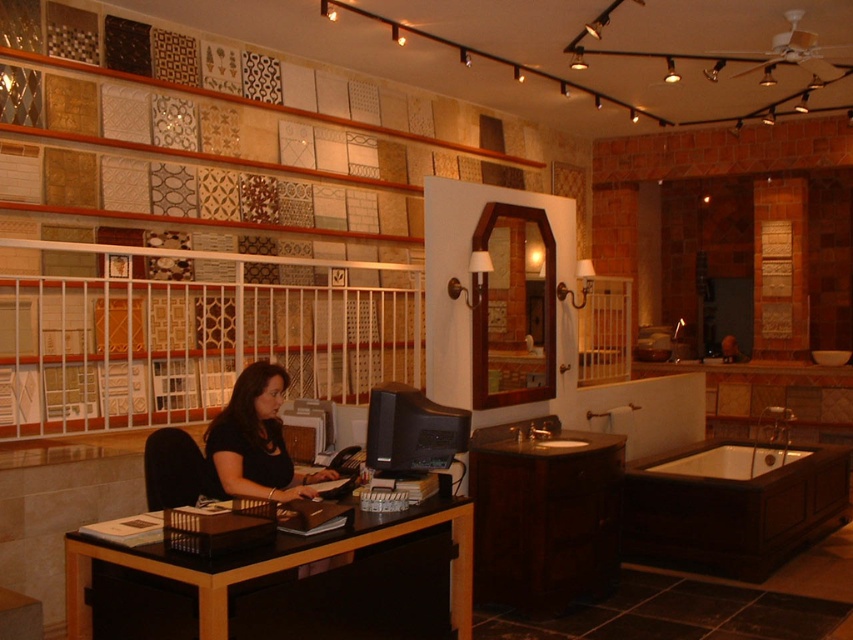
This screenshot has width=853, height=640. Find the location of `black wood desk at center`. black wood desk at center is located at coordinates (270, 564).

In the scene shown: Does black wood desk at center come in front of white glossy bathtub at lower right?

Yes.

Describe the element at coordinates (270, 564) in the screenshot. The width and height of the screenshot is (853, 640). I see `black wood desk at center` at that location.

At what (x,y) coordinates should I click in order to perform the action: click on black wood desk at center. Please return your answer as a coordinate pair (x, y). This screenshot has width=853, height=640. Looking at the image, I should click on (270, 564).

Who is higher up, matte black monitor at center or white glossy bathtub at lower right?

matte black monitor at center is higher up.

The image size is (853, 640). What are the coordinates of `matte black monitor at center` in the screenshot? It's located at (412, 432).

Does point (421, 390) lie in front of point (722, 476)?

Yes.

Find the location of `matte black monitor at center`. matte black monitor at center is located at coordinates (412, 432).

Does point (532, 518) lie in front of point (82, 577)?

No, (532, 518) is further to viewer.

Does dark wood cabinet at lower center lie in front of black wood desk at center?

No, dark wood cabinet at lower center is behind black wood desk at center.

This screenshot has width=853, height=640. Find the location of `dark wood cabinet at lower center`. dark wood cabinet at lower center is located at coordinates (543, 513).